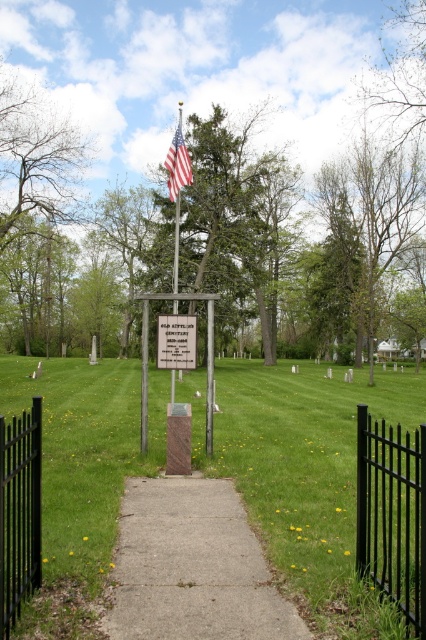
You are a gardener who needs to water the green grass at center and the white plastic sign at center. Your watering can holds enough water for 5 meters of travel. Can you water both without refilling?

The green grass at center and white plastic sign at center are 6.57 meters apart from each other, so the watering can won t hold enough water to reach both without refilling.

You are standing at the entrance of the cemetery and see the point marked at coordinates (x=250, y=244). If you walk straight towards it, how far will you have to walk to reach that point?

The point at coordinates (x=250, y=244) is 124.71 feet away from the viewer, so you will have to walk 124.71 feet to reach it.